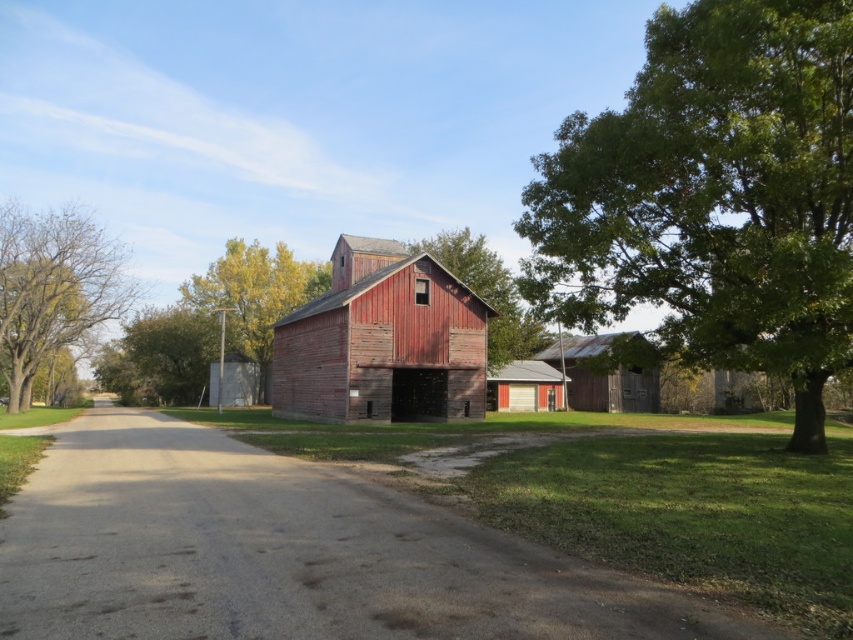
Question: Can you confirm if smooth wooden barn at center is smaller than smooth gray siding at center?

Choices:
 (A) no
 (B) yes

Answer: (A)

Question: Estimate the real-world distances between objects in this image. Which object is closer to the green leafy tree at center?

Choices:
 (A) smooth gray siding at center
 (B) green leafy tree at right

Answer: (A)

Question: Which object appears farthest from the camera in this image?

Choices:
 (A) green leafy tree at center
 (B) rustic wood barn at center
 (C) smooth gray siding at center
 (D) smooth asphalt road at center

Answer: (A)

Question: Which object is closer to the camera taking this photo?

Choices:
 (A) green leafy tree at left
 (B) rustic wood barn at center
 (C) green leafy tree at center

Answer: (B)

Question: Does rustic wood barn at center come in front of smooth wooden barn at center?

Choices:
 (A) no
 (B) yes

Answer: (B)

Question: Can you confirm if rustic wood barn at center is thinner than green leafy tree at center?

Choices:
 (A) no
 (B) yes

Answer: (B)